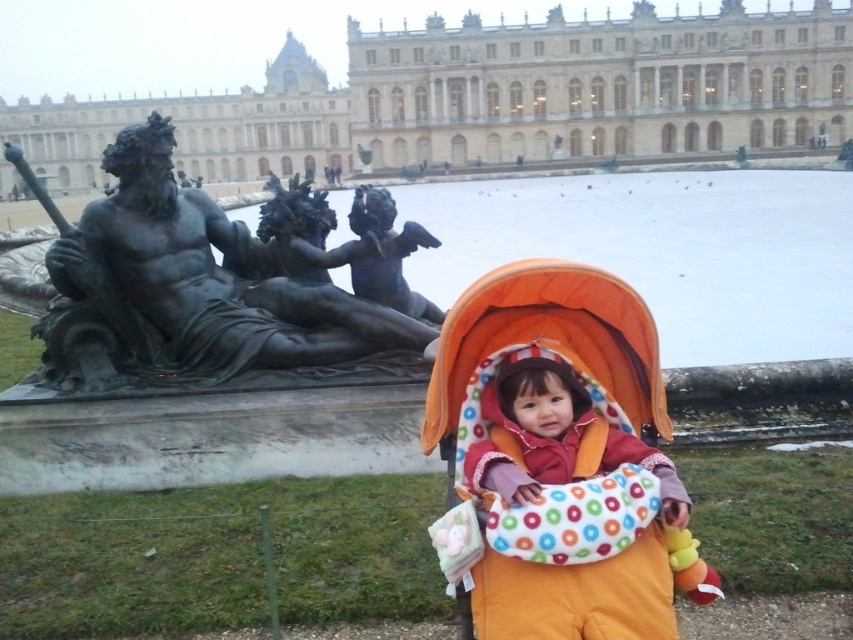
Question: Does stone marble palace at center lie behind bronze cherub at center?

Choices:
 (A) no
 (B) yes

Answer: (B)

Question: Which of these objects is positioned closest to the orange fabric baby carriage at center?

Choices:
 (A) stone marble palace at center
 (B) bronze cherub at center
 (C) bronze statue at left

Answer: (B)

Question: Is stone marble palace at center to the right of bronze statue at left from the viewer's perspective?

Choices:
 (A) no
 (B) yes

Answer: (A)

Question: Which point is closer to the camera taking this photo?

Choices:
 (A) (242, 113)
 (B) (482, 320)
 (C) (360, 248)

Answer: (B)

Question: Where is orange fabric baby carriage at center located in relation to bronze cherub at center in the image?

Choices:
 (A) above
 (B) below

Answer: (B)

Question: Considering the real-world distances, which object is closest to the bronze cherub at center?

Choices:
 (A) orange fabric baby carriage at center
 (B) stone marble palace at center
 (C) bronze statue at left

Answer: (C)